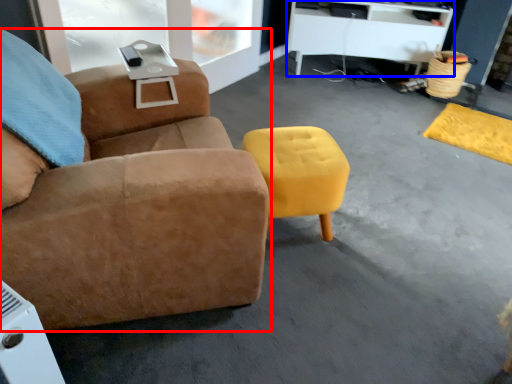
Question: Which object is further to the camera taking this photo, chair (highlighted by a red box) or desk (highlighted by a blue box)?

Choices:
 (A) chair
 (B) desk

Answer: (B)